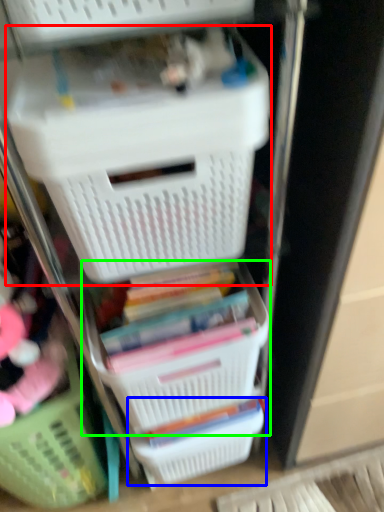
Question: Estimate the real-world distances between objects in this image. Which object is farther from storage box (highlighted by a red box), basket (highlighted by a blue box) or basket (highlighted by a green box)?

Choices:
 (A) basket
 (B) basket

Answer: (A)